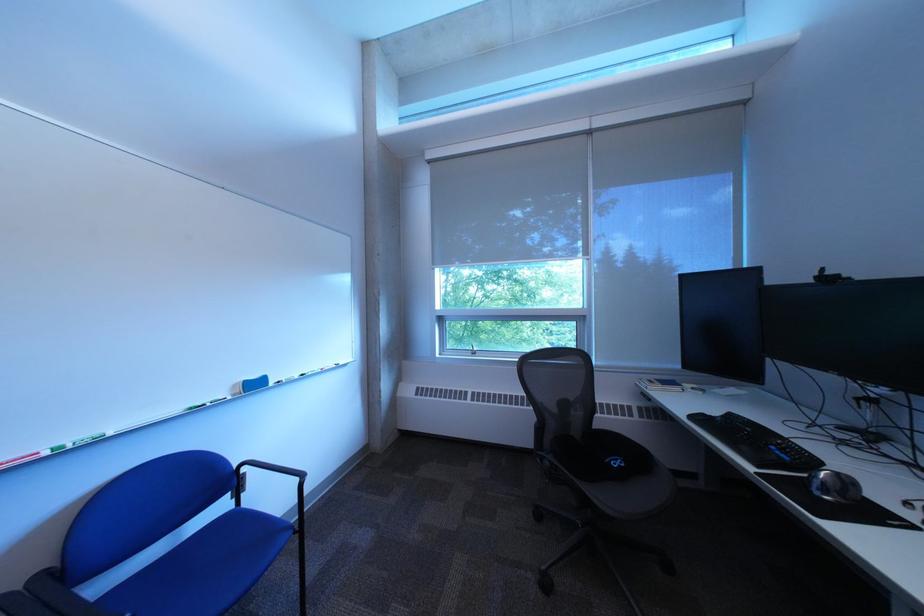
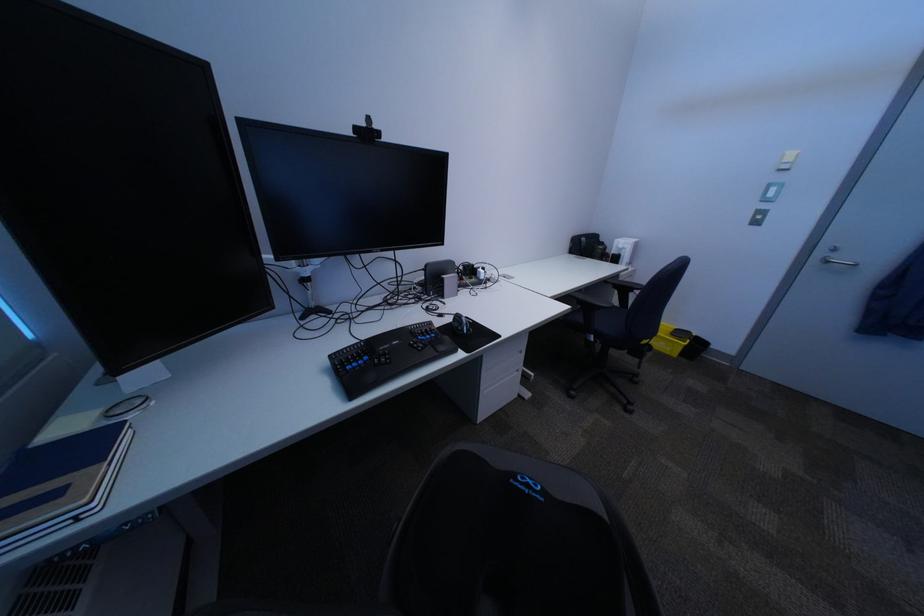
In the second image, find the point that corresponds to point 833,280 in the first image.

(371, 131)